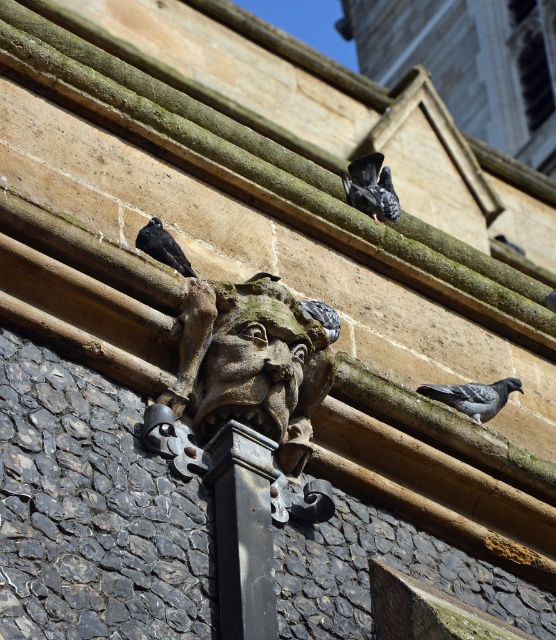
Can you confirm if shiny black bird at upper right is shorter than gray matte pigeon at center?

No.

Is point (356, 173) closer to viewer compared to point (309, 300)?

No, it is behind (309, 300).

At what (x,y) coordinates should I click in order to perform the action: click on shiny black bird at upper right. Please return your answer as a coordinate pair (x, y). Image resolution: width=556 pixels, height=640 pixels. Looking at the image, I should click on (371, 188).

Between point (255, 477) and point (429, 388), which one is positioned in front?

Point (255, 477) is in front.

Is the position of black stone pillar at center more distant than that of gray matte pigeon at lower right?

No, black stone pillar at center is closer to the viewer.

Find the location of a particular element. The width and height of the screenshot is (556, 640). black stone pillar at center is located at coordinates (244, 531).

The image size is (556, 640). Identify the location of black stone pillar at center. (244, 531).

Does gray matte pigeon at lower right have a greater height compared to shiny black bird at upper left?

Incorrect, gray matte pigeon at lower right's height is not larger of shiny black bird at upper left's.

What do you see at coordinates (474, 396) in the screenshot?
I see `gray matte pigeon at lower right` at bounding box center [474, 396].

Where is `gray matte pigeon at lower right`? The width and height of the screenshot is (556, 640). gray matte pigeon at lower right is located at coordinates (474, 396).